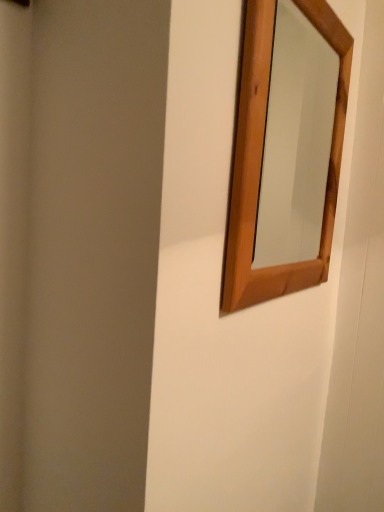
What do you see at coordinates (295, 141) in the screenshot? I see `wooden frame mirror at upper right` at bounding box center [295, 141].

I want to click on wooden frame mirror at upper right, so click(x=295, y=141).

Measure the distance between wooden frame mirror at upper right and camera.

They are 37.05 inches apart.

The height and width of the screenshot is (512, 384). Find the location of `wooden frame mirror at upper right`. wooden frame mirror at upper right is located at coordinates (295, 141).